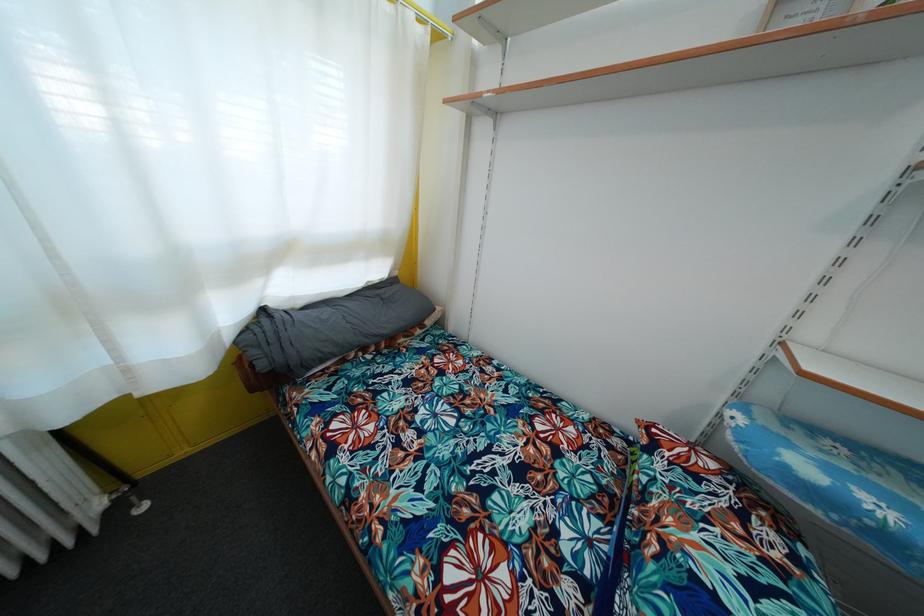
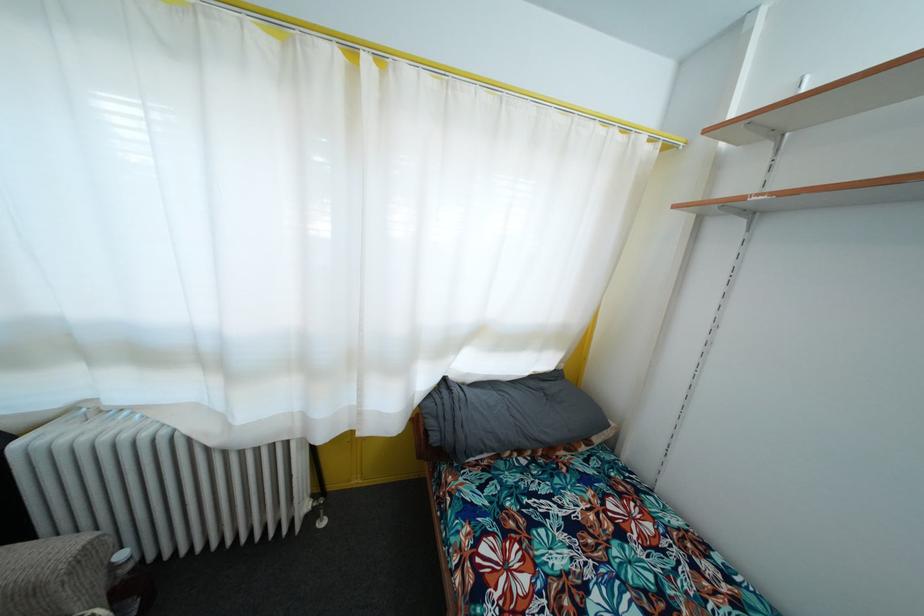
Question: The images are taken continuously from a first-person perspective. In which direction is your viewpoint rotating?

Choices:
 (A) Left
 (B) Right
 (C) Up
 (D) Down

Answer: (A)